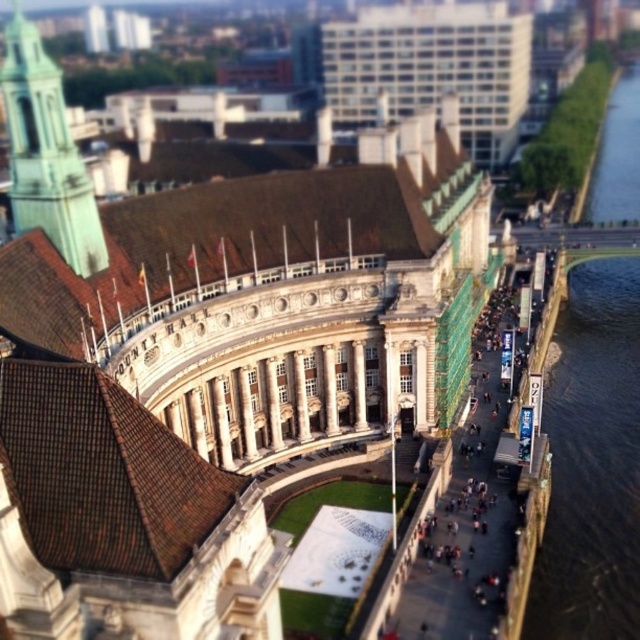
You are standing in front of County Hall and want to take a photo that includes both the point at coordinates point (538,630) and point (17,109). Which point should you focus on first to ensure both are in the frame?

You should focus on point (17,109) first because it is closer to you than point (538,630), which is further away. By focusing on the closer point, the depth of field may help keep both points in the frame.

Consider the image. You are a photographer planning to capture the entire County Hall building and its surroundings. You notice the green water at right and the green glass tower at upper left in your frame. Which object occupies more horizontal space in the image?

The green water at right occupies more horizontal space than the green glass tower at upper left because its width surpasses the tower.

You are standing at the front of County Hall and want to take a photo of the green glass tower at upper left without the green water at right blocking the view. Is this possible?

The green glass tower at upper left is behind the green water at right, so you cannot take a photo of the green glass tower at upper left without the green water at right blocking the view.